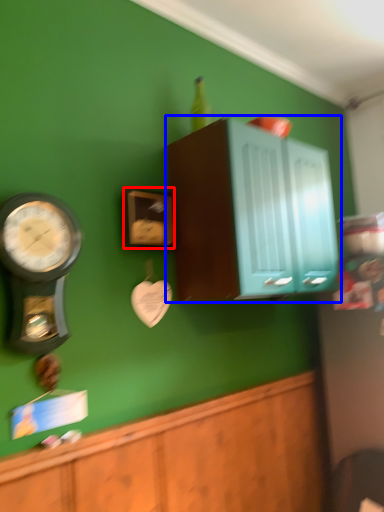
Question: Which point is further to the camera, clock (highlighted by a red box) or cabinetry (highlighted by a blue box)?

Choices:
 (A) clock
 (B) cabinetry

Answer: (A)